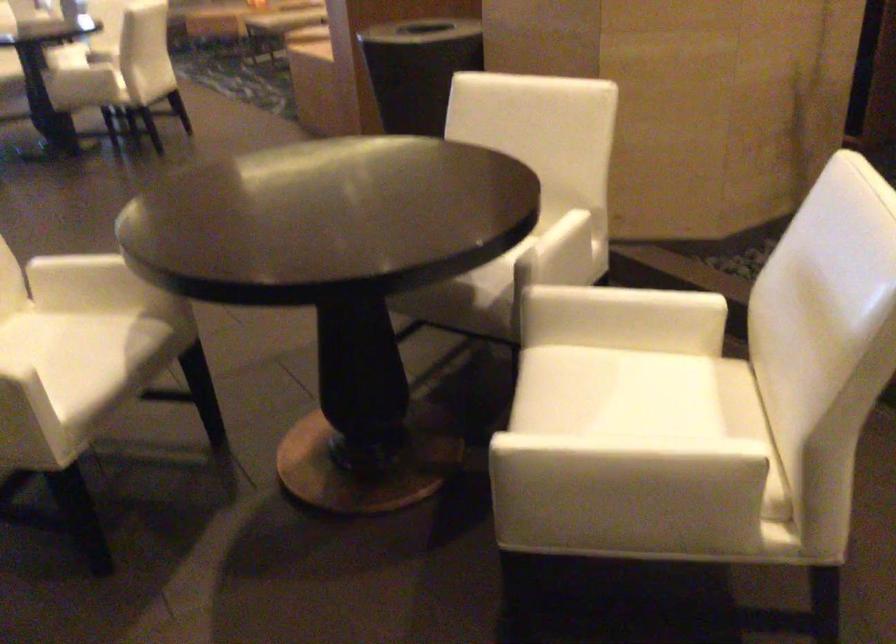
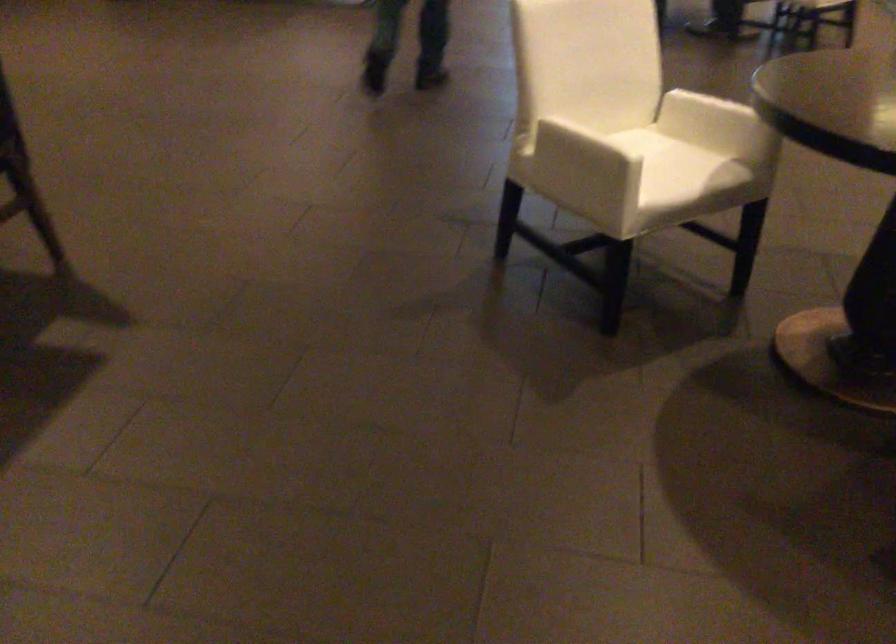
Question: Based on the continuous images, in which direction is the camera rotating? Reply with the corresponding letter.

Choices:
 (A) Left
 (B) Right
 (C) Up
 (D) Down

Answer: (A)